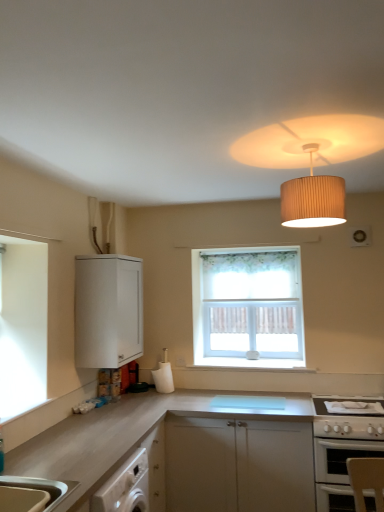
Question: Should I look upward or downward to see white matte cabinet at upper left?

Choices:
 (A) up
 (B) down

Answer: (B)

Question: Is white glossy gas stove at lower right at the left side of white floral curtain at center?

Choices:
 (A) no
 (B) yes

Answer: (A)

Question: Would you say white glossy gas stove at lower right is a long distance from white floral curtain at center?

Choices:
 (A) yes
 (B) no

Answer: (A)

Question: Does white glossy gas stove at lower right turn towards white floral curtain at center?

Choices:
 (A) no
 (B) yes

Answer: (A)

Question: Is white glossy gas stove at lower right facing away from white floral curtain at center?

Choices:
 (A) no
 (B) yes

Answer: (A)

Question: Can you confirm if white glossy gas stove at lower right is taller than white floral curtain at center?

Choices:
 (A) no
 (B) yes

Answer: (A)

Question: Is white glossy gas stove at lower right directly adjacent to white floral curtain at center?

Choices:
 (A) yes
 (B) no

Answer: (B)

Question: Are beige pleated lampshade at upper center and white floral curtain at center located far from each other?

Choices:
 (A) no
 (B) yes

Answer: (B)

Question: Can you confirm if beige pleated lampshade at upper center is bigger than white floral curtain at center?

Choices:
 (A) no
 (B) yes

Answer: (A)

Question: Does beige pleated lampshade at upper center have a lesser height compared to white floral curtain at center?

Choices:
 (A) yes
 (B) no

Answer: (A)

Question: Could white floral curtain at center be considered to be inside beige pleated lampshade at upper center?

Choices:
 (A) yes
 (B) no

Answer: (B)

Question: Considering the relative positions of beige pleated lampshade at upper center and white floral curtain at center in the image provided, is beige pleated lampshade at upper center in front of white floral curtain at center?

Choices:
 (A) no
 (B) yes

Answer: (B)

Question: Does beige pleated lampshade at upper center touch white floral curtain at center?

Choices:
 (A) no
 (B) yes

Answer: (A)

Question: From the image's perspective, is white glossy oven at lower right above white glossy gas stove at lower right?

Choices:
 (A) no
 (B) yes

Answer: (A)